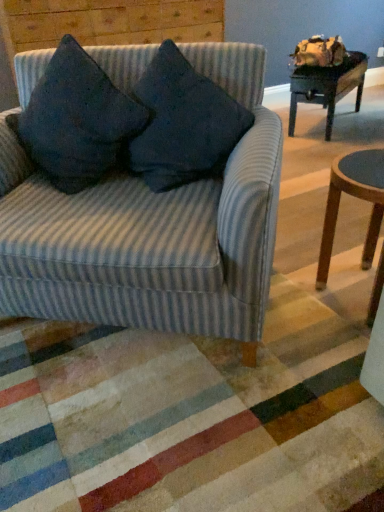
Where is `free area in between wooden round stool at lower right and striped fabric couch at left`? This screenshot has height=512, width=384. free area in between wooden round stool at lower right and striped fabric couch at left is located at coordinates (304, 306).